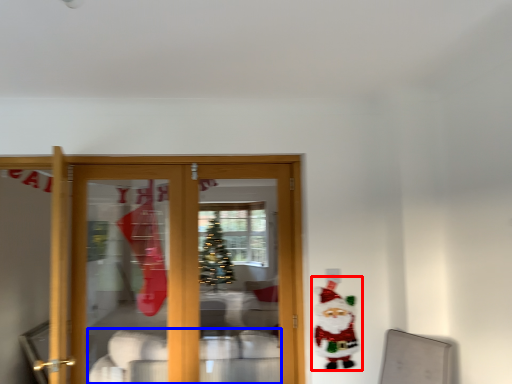
Question: Which object appears farthest to the camera in this image, santa claus (highlighted by a red box) or furniture (highlighted by a blue box)?

Choices:
 (A) santa claus
 (B) furniture

Answer: (B)